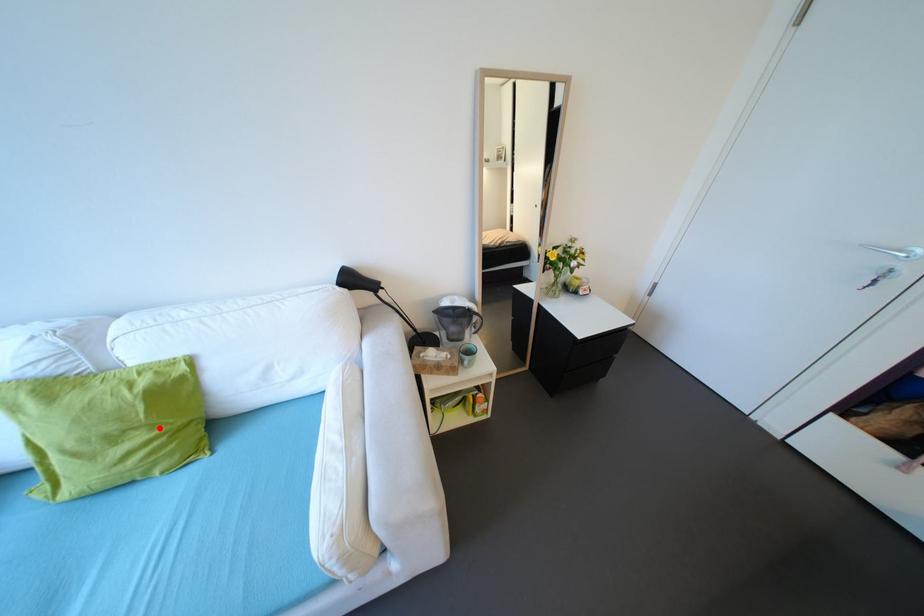
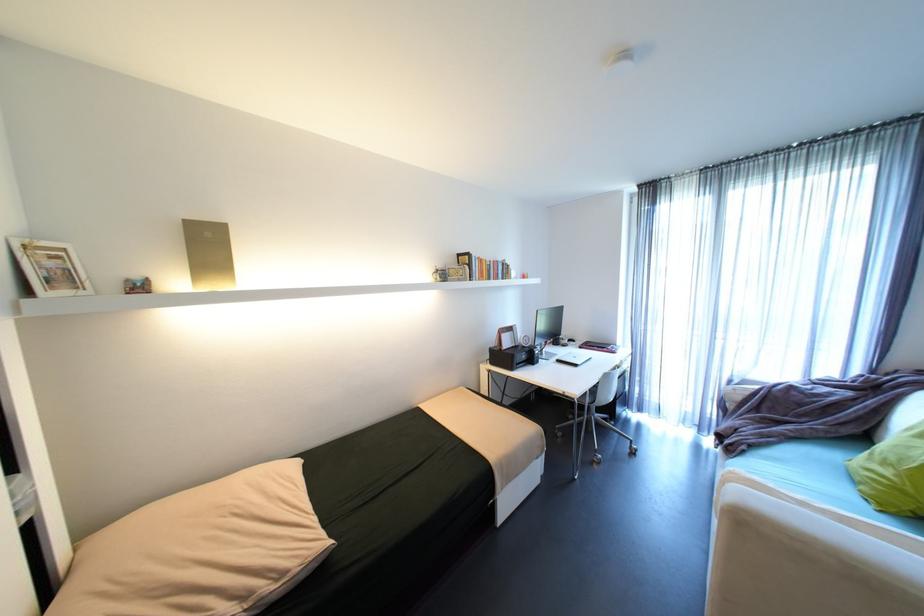
The point at the highlighted location is marked in the first image. Where is the corresponding point in the second image?

(906, 476)